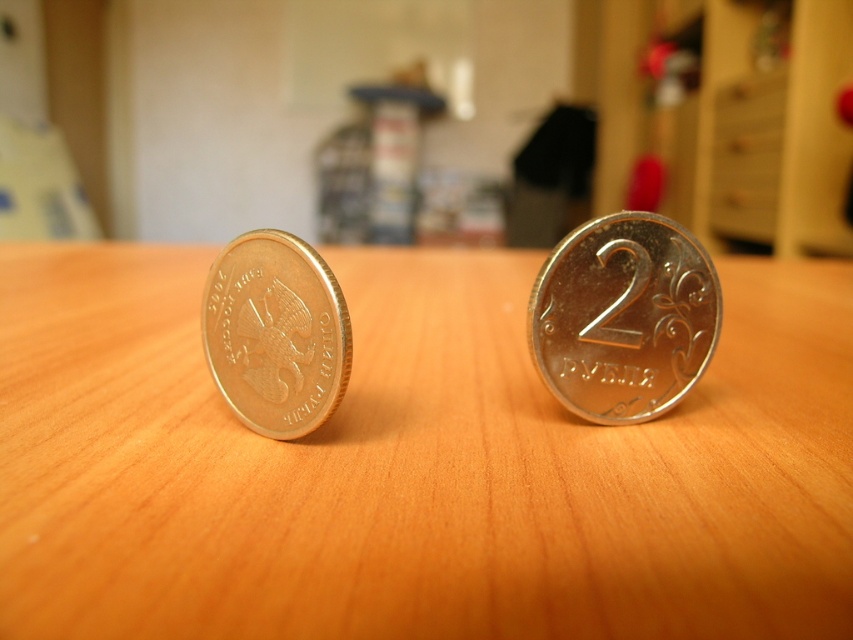
You are arranging items on the wooden table at center and gold metallic coin at left. Which object is positioned to the right of the other?

The wooden table at center is to the right of gold metallic coin at left.

You are setting up a display on the wooden table at center. You have a gold metallic coin at left that needs to be placed on it. Considering the size of the table and the coin, will the coin fit comfortably without touching the edges of the table?

The wooden table at center has a larger size compared to the gold metallic coin at left, so the coin will fit comfortably on the table without touching the edges.